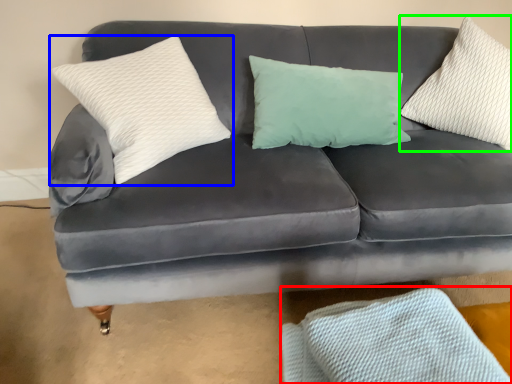
Question: Considering the real-world distances, which object is farthest from material (highlighted by a red box)? pillow (highlighted by a blue box) or pillow (highlighted by a green box)?

Choices:
 (A) pillow
 (B) pillow

Answer: (B)